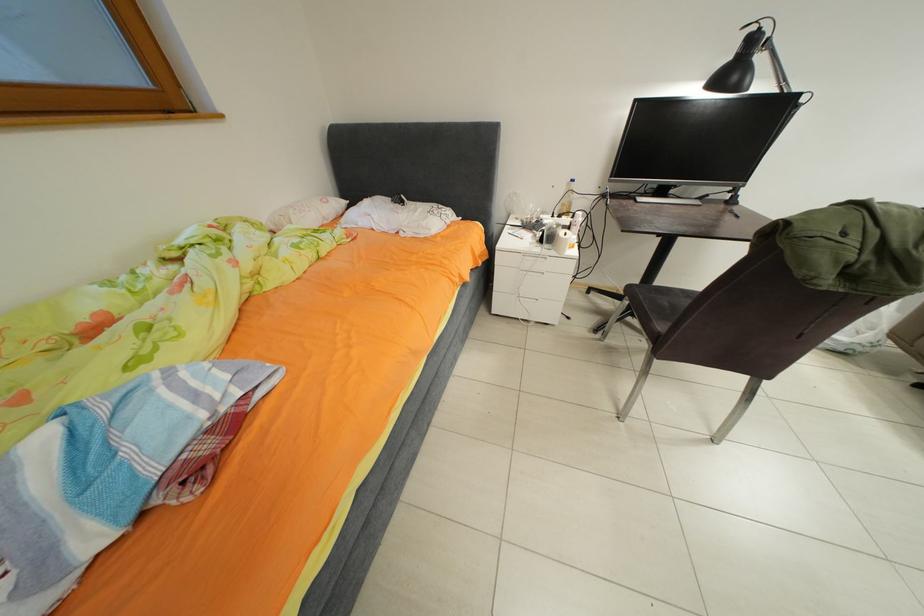
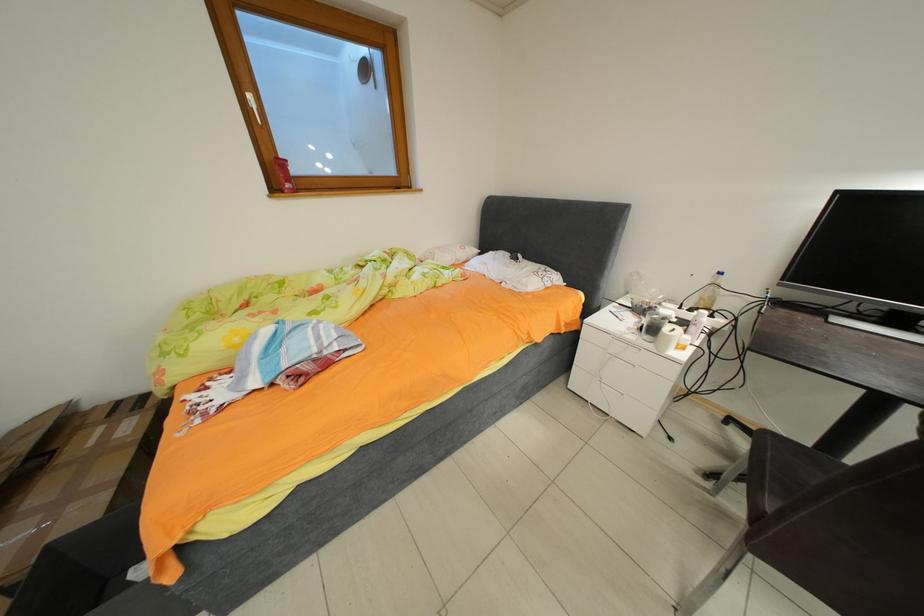
Question: How did the camera likely rotate?

Choices:
 (A) Left
 (B) Right
 (C) Up
 (D) Down

Answer: (A)